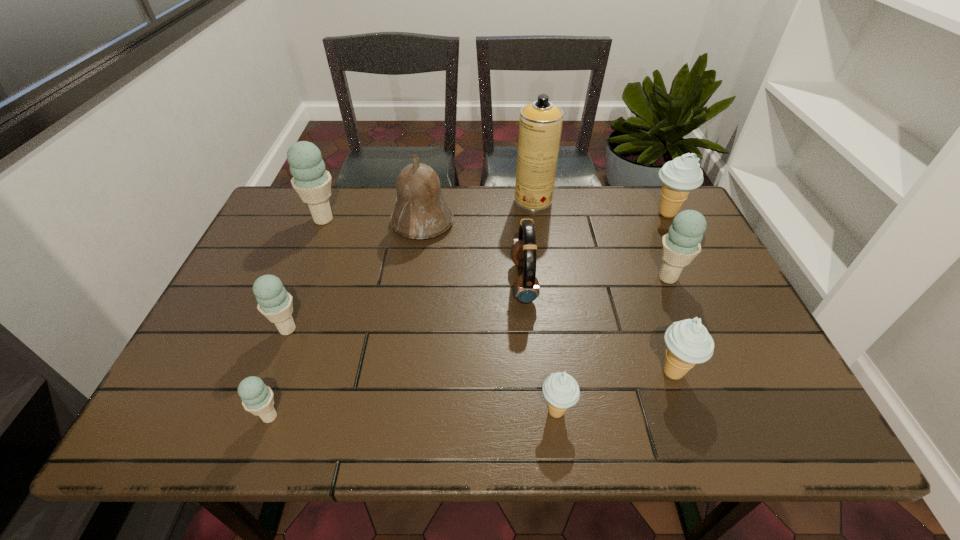
Where is `the third nearest object`? This screenshot has width=960, height=540. the third nearest object is located at coordinates (688, 342).

The height and width of the screenshot is (540, 960). Identify the location of the fourth nearest object. (274, 302).

You are a GUI agent. You are given a task and a screenshot of the screen. Output one action in this format:
    pyautogui.click(x=<x>, y=<y>)
    Task: Click on the fourth nearest ice cream
    This screenshot has height=540, width=960.
    Given the screenshot: What is the action you would take?
    pyautogui.click(x=274, y=302)

Find the location of a particular element. The width and height of the screenshot is (960, 540). the smallest beige icecream is located at coordinates (561, 390).

Image resolution: width=960 pixels, height=540 pixels. I want to click on the fourth ice cream from left to right, so click(x=561, y=390).

You are a GUI agent. You are given a task and a screenshot of the screen. Output one action in this format:
    pyautogui.click(x=<x>, y=<y>)
    Task: Click on the smallest blue ice cream
    
    Given the screenshot: What is the action you would take?
    pyautogui.click(x=257, y=398)

This screenshot has width=960, height=540. What are the coordinates of `vacant position located on the front of the aerosol can` in the screenshot? It's located at (546, 288).

I want to click on vacant space located on the front of the biggest blue ice cream, so click(303, 268).

Where is `vacant space located on the back of the seventh object from right to left`? vacant space located on the back of the seventh object from right to left is located at coordinates (427, 192).

Find the location of a particular element. blank space located 0.230m on the front of the biggest beige icecream is located at coordinates (701, 281).